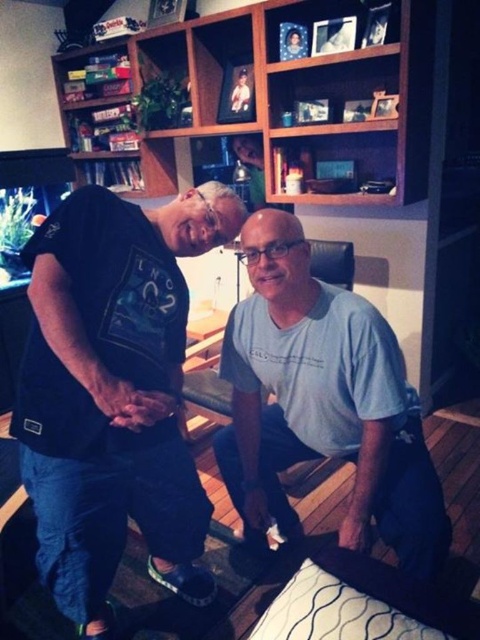
Question: Among these objects, which one is nearest to the camera?

Choices:
 (A) light blue cotton shirt at center
 (B) black cotton t-shirt at center

Answer: (B)

Question: Considering the relative positions of black cotton t-shirt at center and light blue cotton shirt at center in the image provided, where is black cotton t-shirt at center located with respect to light blue cotton shirt at center?

Choices:
 (A) below
 (B) above

Answer: (A)

Question: Which object appears farthest from the camera in this image?

Choices:
 (A) black cotton t-shirt at center
 (B) wooden bookshelf at upper center

Answer: (B)

Question: Which is farther from the wooden bookshelf at upper center?

Choices:
 (A) black cotton t-shirt at center
 (B) light blue cotton shirt at center

Answer: (A)

Question: Is black cotton t-shirt at center closer to the viewer compared to light blue cotton shirt at center?

Choices:
 (A) no
 (B) yes

Answer: (B)

Question: Observing the image, what is the correct spatial positioning of light blue cotton shirt at center in reference to wooden bookshelf at upper center?

Choices:
 (A) above
 (B) below

Answer: (B)